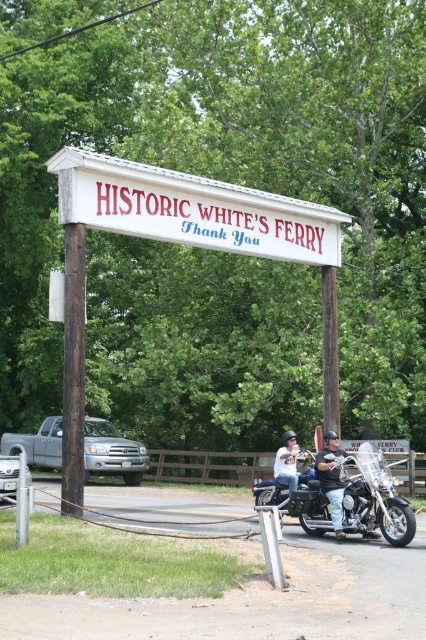
Question: Which of the following is the farthest from the observer?

Choices:
 (A) pyautogui.click(x=310, y=252)
 (B) pyautogui.click(x=71, y=250)
 (C) pyautogui.click(x=282, y=515)
 (D) pyautogui.click(x=328, y=417)

Answer: (A)

Question: Where is brown wooden pole at center located in relation to shiny blue motorcycle at center in the image?

Choices:
 (A) right
 (B) left

Answer: (A)

Question: Which object is closer to the camera taking this photo?

Choices:
 (A) rusty wood signpost at left
 (B) white wooden signboard at upper center
 (C) brown wooden pole at center
 (D) white leather jacket at center

Answer: (A)

Question: Can you confirm if white wooden signboard at upper center is bigger than white leather jacket at center?

Choices:
 (A) no
 (B) yes

Answer: (A)

Question: Which is nearer to the white wooden signboard at upper center?

Choices:
 (A) rusty wood signpost at left
 (B) brown wooden pole at center
 (C) white leather jacket at center
 (D) shiny blue motorcycle at center

Answer: (A)

Question: Can you confirm if brown wooden pole at center is wider than shiny blue motorcycle at center?

Choices:
 (A) no
 (B) yes

Answer: (B)